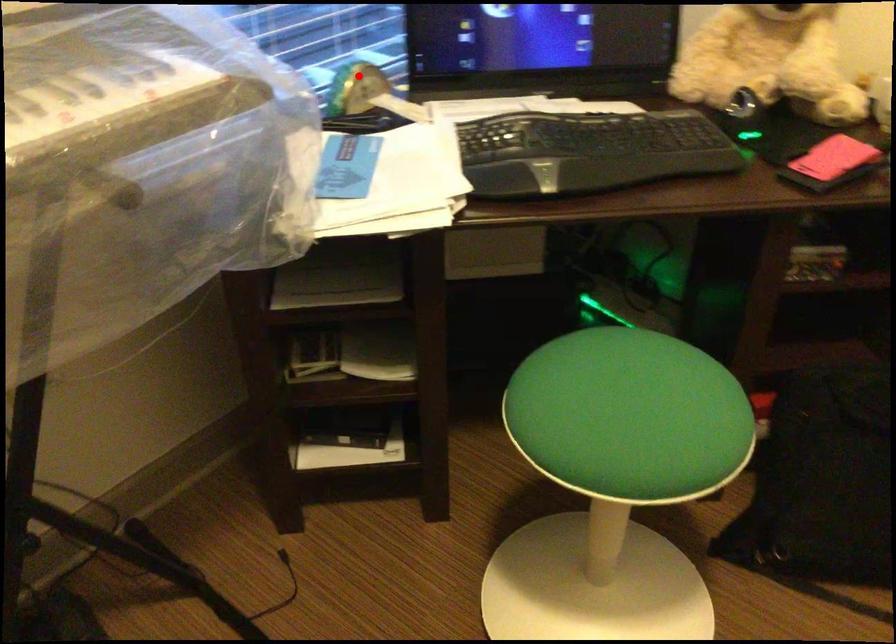
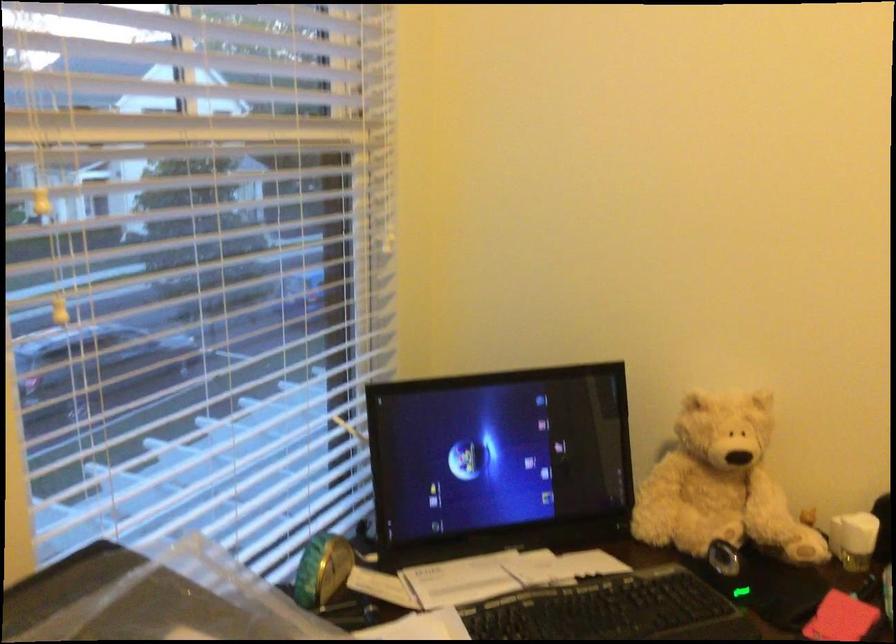
Locate, in the second image, the point that corresponds to the highlighted location in the first image.

(322, 569)